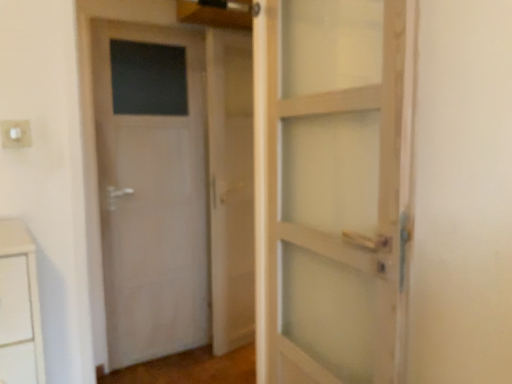
The height and width of the screenshot is (384, 512). What do you see at coordinates (151, 188) in the screenshot? I see `white matte door at left` at bounding box center [151, 188].

Locate an element on the screen. Image resolution: width=512 pixels, height=384 pixels. white wooden barn door at center is located at coordinates tap(230, 187).

Where is `white plastic electric outlet at upper left`? This screenshot has width=512, height=384. white plastic electric outlet at upper left is located at coordinates (16, 133).

How different are the orientations of white plastic electric outlet at upper left and white matte door at left in degrees?

The angle between the facing direction of white plastic electric outlet at upper left and the facing direction of white matte door at left is 0.314 degrees.

Which is correct: white plastic electric outlet at upper left is inside white matte door at left, or outside of it?

white plastic electric outlet at upper left cannot be found inside white matte door at left.

Is white plastic electric outlet at upper left behind white matte door at left?

That is False.

Does white wooden barn door at center have a larger size compared to white matte door at left?

No.

Does point (220, 177) come farther from viewer compared to point (164, 51)?

Yes, point (220, 177) is behind point (164, 51).

Can you tell me how much white wooden barn door at center and white matte door at left differ in facing direction?

The angular difference between white wooden barn door at center and white matte door at left is 8.79 degrees.

Does white wooden barn door at center appear on the left side of white matte door at left?

No, white wooden barn door at center is not to the left of white matte door at left.

From a real-world perspective, which object rests below the other?

From a 3D spatial view, white wooden barn door at center is below.

Is white plastic electric outlet at upper left outside of white wooden barn door at center?

Yes.

In terms of width, does white plastic electric outlet at upper left look wider or thinner when compared to white wooden barn door at center?

Clearly, white plastic electric outlet at upper left has less width compared to white wooden barn door at center.

Between white matte door at left and white plastic electric outlet at upper left, which one is positioned in front?

white plastic electric outlet at upper left.

Considering the relative sizes of white matte door at left and white plastic electric outlet at upper left in the image provided, is white matte door at left taller than white plastic electric outlet at upper left?

Yes.

Looking at this image, from a real-world perspective, is white matte door at left beneath white plastic electric outlet at upper left?

Correct, in the physical world, white matte door at left is lower than white plastic electric outlet at upper left.

Is white matte door at left bigger than white wooden barn door at center?

Yes.

From a real-world perspective, is white matte door at left beneath white wooden barn door at center?

Incorrect, from a real-world perspective, white matte door at left is higher than white wooden barn door at center.

Can you confirm if white wooden barn door at center is thinner than white plastic electric outlet at upper left?

No.

From a real-world perspective, between white wooden barn door at center and white plastic electric outlet at upper left, who is vertically lower?

white wooden barn door at center, from a real-world perspective.

The image size is (512, 384). There is a white wooden barn door at center. In order to click on electric outlet above it (from a real-world perspective) in this screenshot , I will do `click(16, 133)`.

In terms of size, does white wooden barn door at center appear bigger or smaller than white plastic electric outlet at upper left?

white wooden barn door at center is bigger than white plastic electric outlet at upper left.

Identify the location of electric outlet in front of the white matte door at left. The height and width of the screenshot is (384, 512). (16, 133).

Find the location of a particular element. barn door located above the white matte door at left (from the image's perspective) is located at coordinates (230, 187).

From the image, which object appears to be nearer to white wooden barn door at center, white plastic electric outlet at upper left or white matte door at left?

Among the two, white matte door at left is located nearer to white wooden barn door at center.

Looking at the image, which one is located further to white wooden barn door at center, white matte door at left or white plastic electric outlet at upper left?

white plastic electric outlet at upper left lies further to white wooden barn door at center than the other object.

Based on their spatial positions, is white matte door at left or white wooden barn door at center further from white plastic electric outlet at upper left?

white wooden barn door at center is further to white plastic electric outlet at upper left.

Looking at the image, which one is located closer to white matte door at left, white wooden barn door at center or white plastic electric outlet at upper left?

white wooden barn door at center is closer to white matte door at left.

Based on their spatial positions, is white wooden barn door at center or white matte door at left further from white plastic electric outlet at upper left?

white wooden barn door at center is positioned further to the anchor white plastic electric outlet at upper left.

Which object lies further to the anchor point white matte door at left, white plastic electric outlet at upper left or white wooden barn door at center?

white plastic electric outlet at upper left.

Find the location of a particular element. The width and height of the screenshot is (512, 384). door between white plastic electric outlet at upper left and white wooden barn door at center along the z-axis is located at coordinates (151, 188).